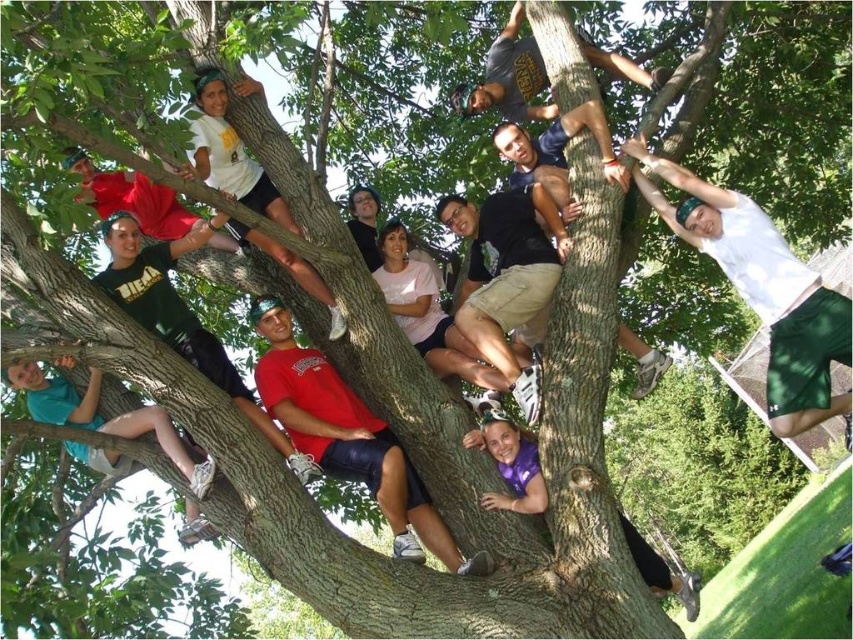
Question: From the image, what is the correct spatial relationship of white matte shorts at upper right in relation to teal matte shorts at lower left?

Choices:
 (A) below
 (B) above

Answer: (B)

Question: Which point is farther to the camera?

Choices:
 (A) teal matte shorts at lower left
 (B) white matte shorts at upper right

Answer: (B)

Question: Is white matte shorts at upper right positioned at the back of teal matte shorts at lower left?

Choices:
 (A) no
 (B) yes

Answer: (B)

Question: Where is white matte shorts at upper right located in relation to teal matte shorts at lower left in the image?

Choices:
 (A) right
 (B) left

Answer: (A)

Question: Which point appears closest to the camera in this image?

Choices:
 (A) (202, 477)
 (B) (641, 193)

Answer: (A)